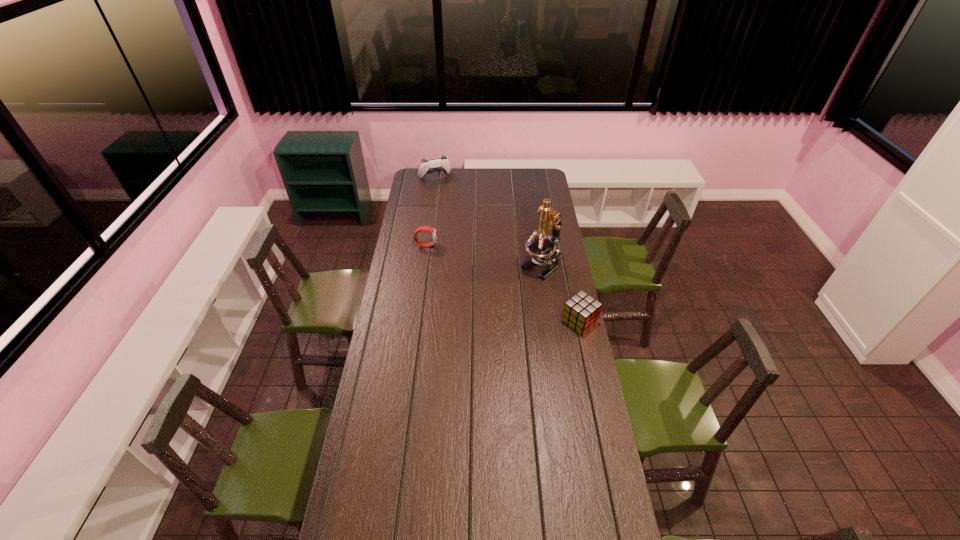
This screenshot has height=540, width=960. What are the coordinates of `free spot between the watch and the second nearest object` in the screenshot? It's located at (485, 255).

Where is `empty location between the microscope and the watch`? The height and width of the screenshot is (540, 960). empty location between the microscope and the watch is located at coordinates (485, 255).

This screenshot has height=540, width=960. Find the location of `object that is the third closest to the cube`. object that is the third closest to the cube is located at coordinates (441, 164).

The image size is (960, 540). What are the coordinates of `object that stands as the second closest to the tallest object` in the screenshot? It's located at (425, 228).

Identify the location of free space that satisfies the following two spatial constraints: 1. on the front side of the farthest object; 2. on the right side of the tallest object. The width and height of the screenshot is (960, 540). (422, 266).